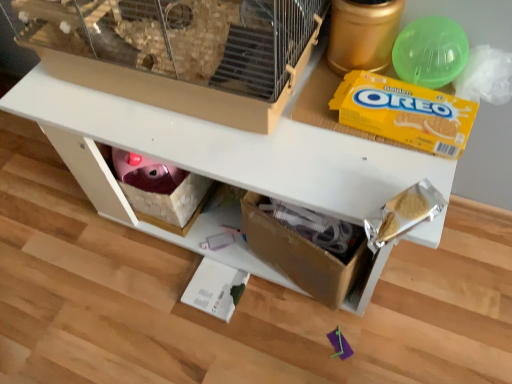
Question: Is yellow cardboard oreo at upper right at the back of white matte table at center?

Choices:
 (A) yes
 (B) no

Answer: (B)

Question: Considering the relative positions of white matte table at center and yellow cardboard oreo at upper right in the image provided, is white matte table at center in front of yellow cardboard oreo at upper right?

Choices:
 (A) no
 (B) yes

Answer: (B)

Question: Is the position of white matte table at center more distant than that of yellow cardboard oreo at upper right?

Choices:
 (A) yes
 (B) no

Answer: (B)

Question: From the image's perspective, would you say white matte table at center is positioned over yellow cardboard oreo at upper right?

Choices:
 (A) yes
 (B) no

Answer: (B)

Question: From the image's perspective, is white matte table at center beneath yellow cardboard oreo at upper right?

Choices:
 (A) yes
 (B) no

Answer: (A)

Question: Visually, is beige plastic bird cage at upper center positioned to the left or to the right of green plastic ball at upper right?

Choices:
 (A) left
 (B) right

Answer: (A)

Question: Is beige plastic bird cage at upper center bigger or smaller than green plastic ball at upper right?

Choices:
 (A) small
 (B) big

Answer: (B)

Question: Considering the positions of beige plastic bird cage at upper center and green plastic ball at upper right in the image, is beige plastic bird cage at upper center wider or thinner than green plastic ball at upper right?

Choices:
 (A) thin
 (B) wide

Answer: (B)

Question: From a real-world perspective, is beige plastic bird cage at upper center above or below green plastic ball at upper right?

Choices:
 (A) above
 (B) below

Answer: (A)

Question: In terms of height, does yellow cardboard oreo at upper right look taller or shorter compared to green plastic ball at upper right?

Choices:
 (A) tall
 (B) short

Answer: (B)

Question: Considering the positions of yellow cardboard oreo at upper right and green plastic ball at upper right in the image, is yellow cardboard oreo at upper right wider or thinner than green plastic ball at upper right?

Choices:
 (A) thin
 (B) wide

Answer: (B)

Question: From the image's perspective, is yellow cardboard oreo at upper right positioned above or below green plastic ball at upper right?

Choices:
 (A) below
 (B) above

Answer: (A)

Question: From a real-world perspective, is yellow cardboard oreo at upper right above or below green plastic ball at upper right?

Choices:
 (A) above
 (B) below

Answer: (B)

Question: In terms of size, does yellow cardboard oreo at upper right appear bigger or smaller than white matte table at center?

Choices:
 (A) small
 (B) big

Answer: (A)

Question: Considering the positions of yellow cardboard oreo at upper right and white matte table at center in the image, is yellow cardboard oreo at upper right taller or shorter than white matte table at center?

Choices:
 (A) tall
 (B) short

Answer: (B)